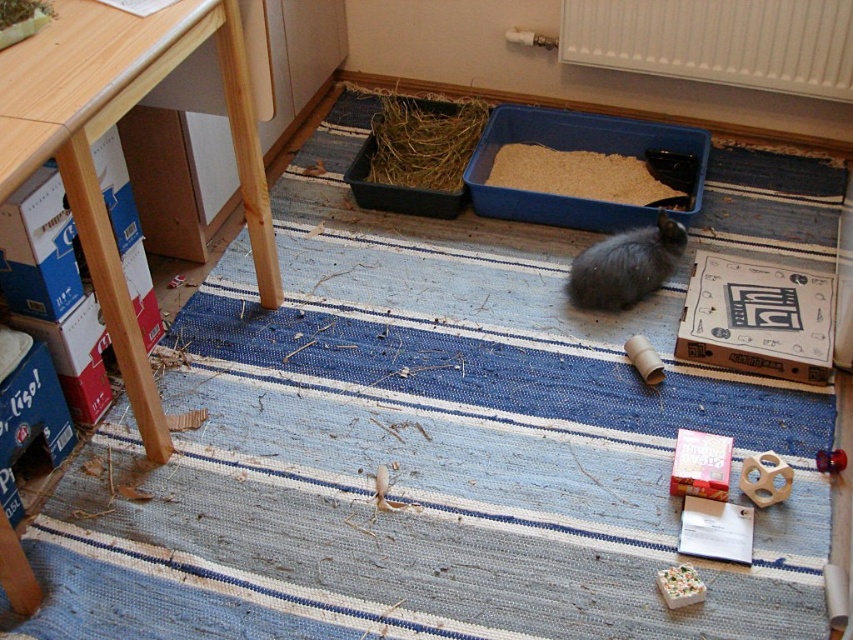
Does brown straw at center have a smaller size compared to matte pink box at lower right?

Actually, brown straw at center might be larger than matte pink box at lower right.

Measure the distance from brown straw at center to matte pink box at lower right.

1.23 meters

Is point (412, 122) positioned after point (694, 461)?

Yes, point (412, 122) is farther from viewer.

Identify the location of brown straw at center. The width and height of the screenshot is (853, 640). (422, 141).

Is the position of brown cardboard box at center right more distant than that of matte pink box at lower right?

That is True.

Does point (796, 292) come in front of point (700, 474)?

No, it is not.

I want to click on brown cardboard box at center right, so click(x=757, y=317).

Describe the element at coordinates (39, 248) in the screenshot. I see `blue cardboard box at left` at that location.

Which is more to the left, blue cardboard box at left or matte pink box at lower right?

blue cardboard box at left is more to the left.

Is point (47, 186) in front of point (677, 444)?

Yes.

You are a GUI agent. You are given a task and a screenshot of the screen. Output one action in this format:
    pyautogui.click(x=<x>, y=<y>)
    Task: Click on the blue cardboard box at left
    
    Given the screenshot: What is the action you would take?
    pyautogui.click(x=39, y=248)